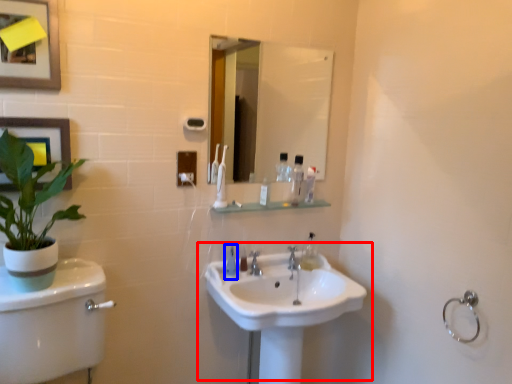
Question: Which of the following is the closest to the observer, sink (highlighted by a red box) or mouthwash (highlighted by a blue box)?

Choices:
 (A) sink
 (B) mouthwash

Answer: (A)